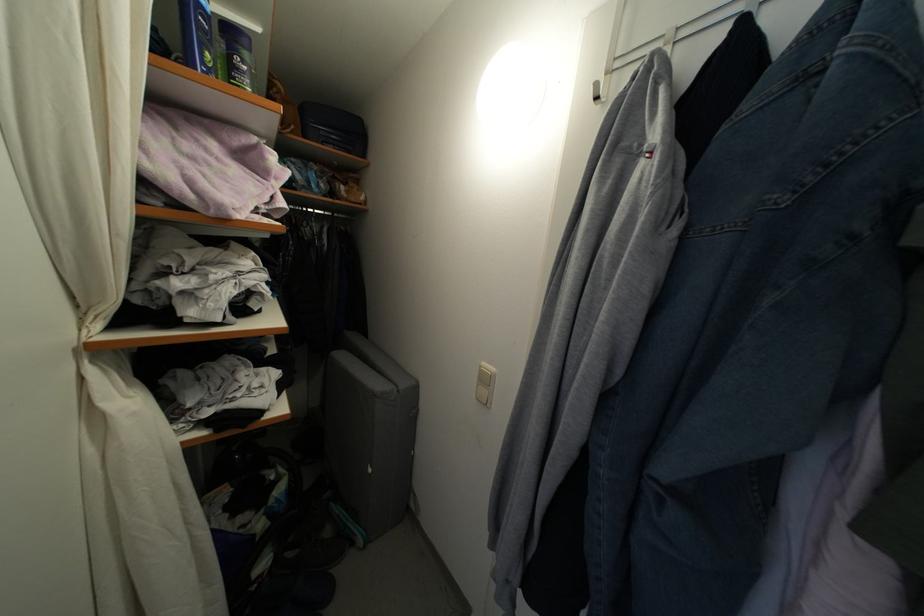
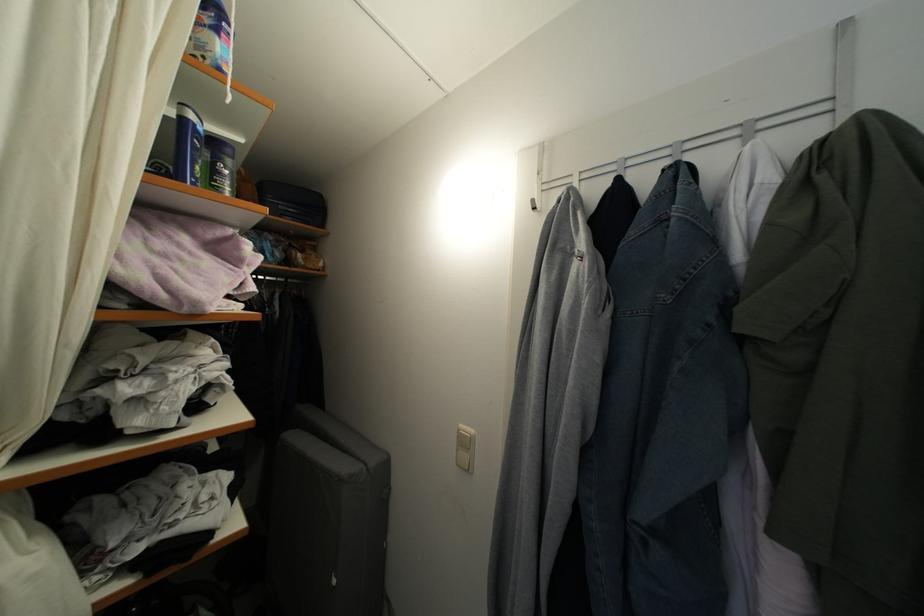
Where in the second image is the point corresponding to [602,91] from the first image?

(538, 207)